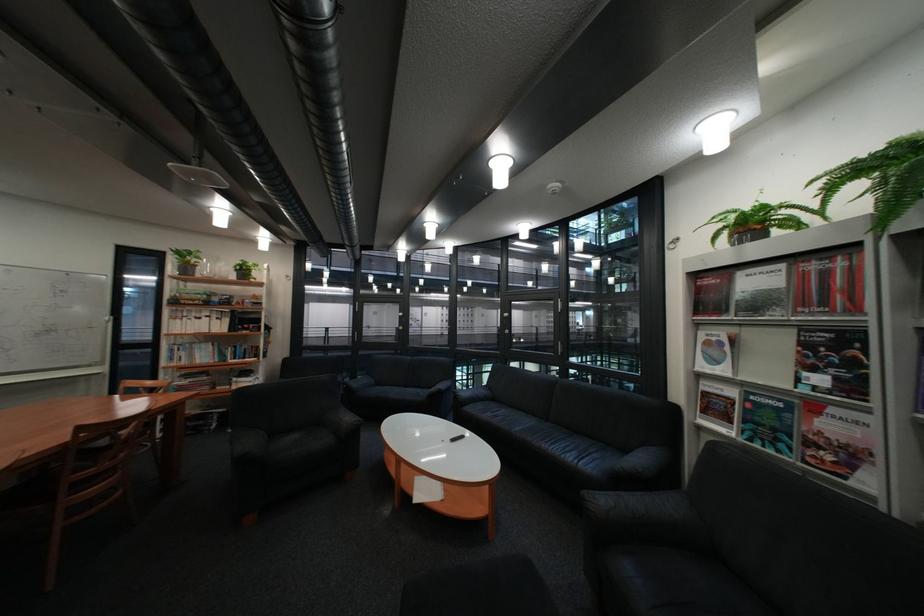
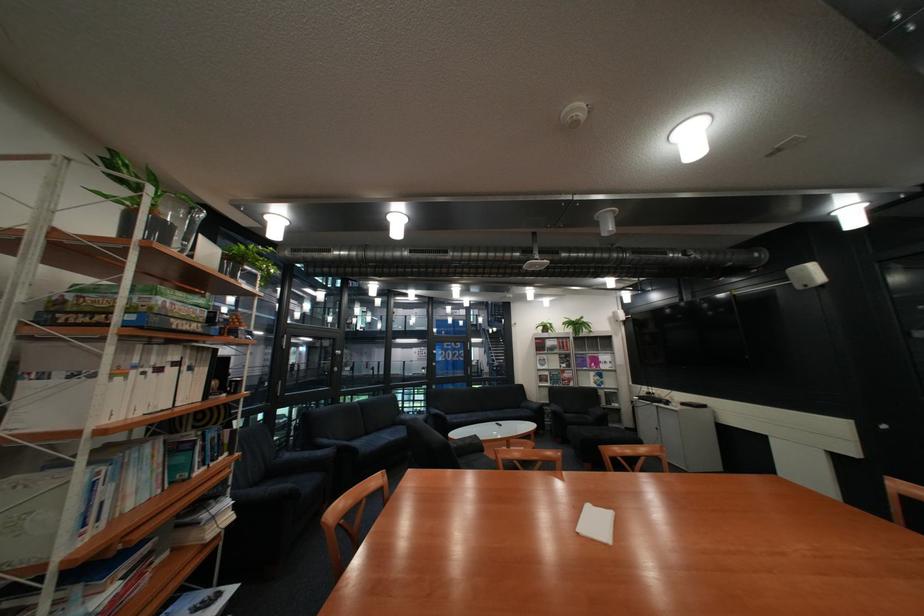
The point at (x=193, y=320) is marked in the first image. Where is the corresponding point in the second image?

(134, 379)